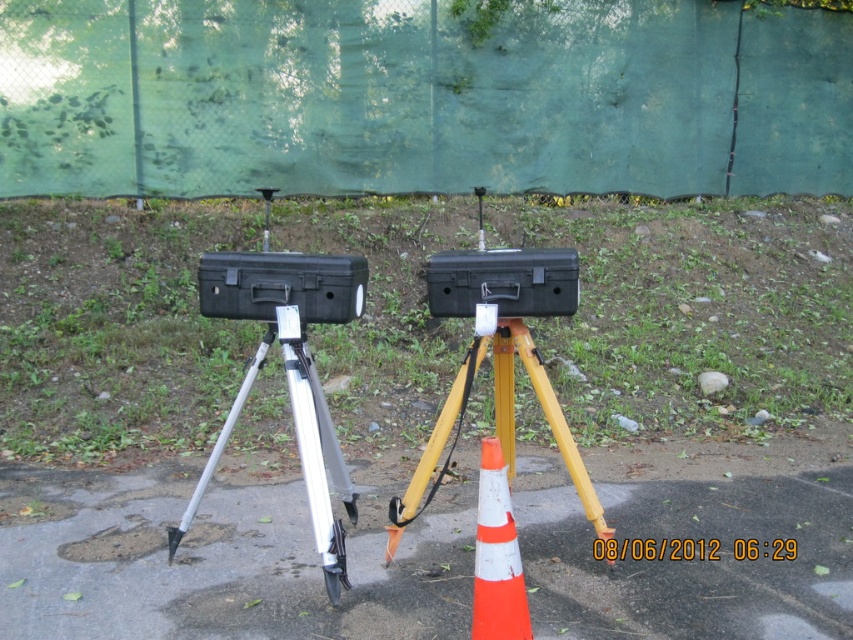
Question: Based on their relative distances, which object is nearer to the yellow metallic tripod at center?

Choices:
 (A) smooth asphalt pavement at center
 (B) black hard case at center

Answer: (B)

Question: Estimate the real-world distances between objects in this image. Which object is farther from the black hard case at center?

Choices:
 (A) orange/white plastic traffic cone at center
 (B) silver metallic tripod at center
 (C) yellow metallic tripod at center
 (D) smooth asphalt pavement at center

Answer: (D)

Question: Is yellow metallic tripod at center further to camera compared to black hard case at center?

Choices:
 (A) yes
 (B) no

Answer: (B)

Question: Which object is the farthest from the black hard case at center?

Choices:
 (A) orange/white plastic traffic cone at center
 (B) yellow metallic tripod at center

Answer: (A)

Question: In this image, where is yellow metallic tripod at center located relative to orange/white plastic traffic cone at center?

Choices:
 (A) above
 (B) below

Answer: (A)

Question: Is the position of yellow metallic tripod at center more distant than that of black hard case at center?

Choices:
 (A) no
 (B) yes

Answer: (A)